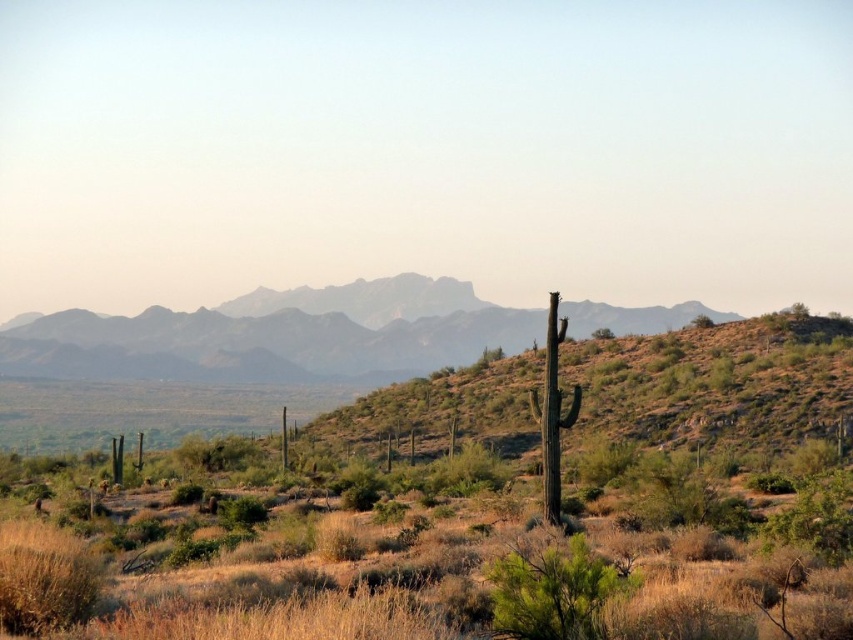
Question: From the image, what is the correct spatial relationship of green shrubbery at center in relation to gray rocky mountain range at center?

Choices:
 (A) left
 (B) right

Answer: (A)

Question: Is the position of green shrubbery at center more distant than that of gray rocky mountain range at center?

Choices:
 (A) no
 (B) yes

Answer: (A)

Question: Which point is closer to the camera?

Choices:
 (A) (202, 538)
 (B) (28, 369)

Answer: (A)

Question: Is green shrubbery at center positioned in front of gray rocky mountain range at center?

Choices:
 (A) yes
 (B) no

Answer: (A)